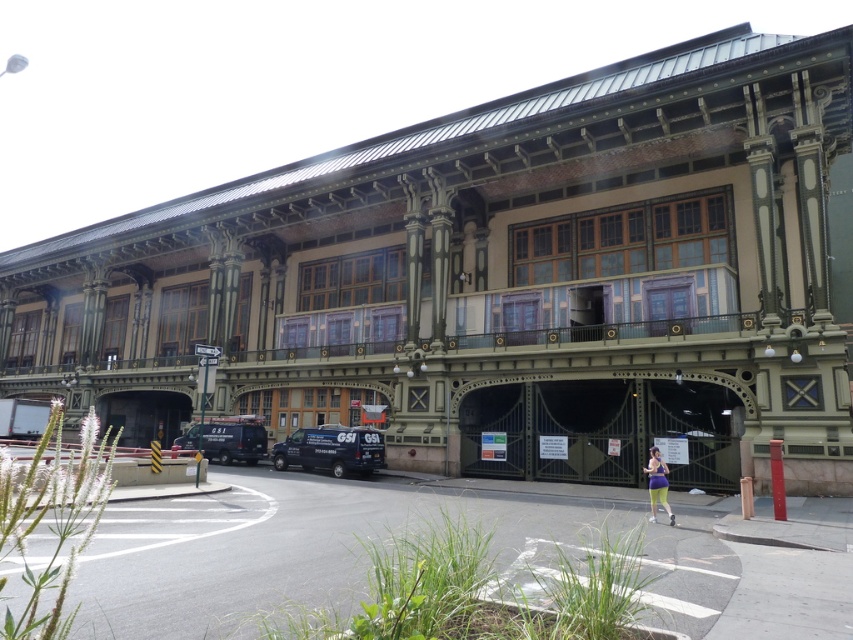
Where is `matte black van at center`? This screenshot has height=640, width=853. matte black van at center is located at coordinates (331, 451).

Who is more distant from viewer, (306,465) or (779,442)?

Point (306,465)

You are a GUI agent. You are given a task and a screenshot of the screen. Output one action in this format:
    pyautogui.click(x=<x>, y=<y>)
    Task: Click on the matte black van at center
    The image size is (853, 640).
    Given the screenshot: What is the action you would take?
    pyautogui.click(x=331, y=451)

Does matte black van at lower left appear on the right side of red matte pillar at lower right?

No, matte black van at lower left is not to the right of red matte pillar at lower right.

Who is higher up, matte black van at lower left or red matte pillar at lower right?

red matte pillar at lower right is higher up.

Locate an element on the screen. This screenshot has width=853, height=640. matte black van at lower left is located at coordinates (225, 440).

Who is positioned more to the left, matte black van at center or matte black van at lower left?

Positioned to the left is matte black van at lower left.

At what (x,y) coordinates should I click in order to perform the action: click on matte black van at center. Please return your answer as a coordinate pair (x, y). Looking at the image, I should click on (331, 451).